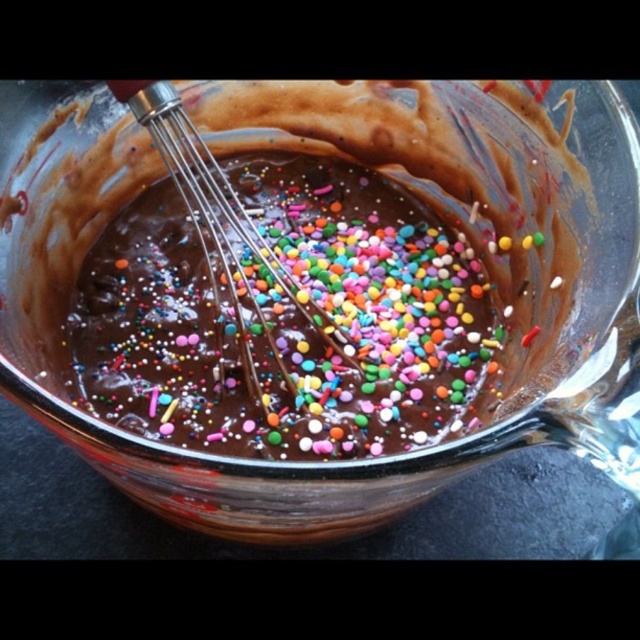
Is transparent glass bowl at center shorter than chocolatesmoothbowl at center?

No.

Does transparent glass bowl at center appear under chocolatesmoothbowl at center?

No.

Identify the location of transparent glass bowl at center. The image size is (640, 640). (324, 157).

Does point (355, 241) come behind point (211, 282)?

Yes, it is behind point (211, 282).

Which is above, chocolatesmoothbowl at center or metallic whisk at center?

metallic whisk at center is above.

Who is more distant from viewer, (260, 452) or (154, 138)?

The point (154, 138) is more distant.

The image size is (640, 640). I want to click on chocolatesmoothbowl at center, so click(289, 320).

Is transparent glass bowl at center taller than metallic whisk at center?

Result: Yes, transparent glass bowl at center is taller than metallic whisk at center.

Which is in front, point (83, 152) or point (177, 106)?

Point (177, 106) is more forward.

This screenshot has height=640, width=640. In order to click on transparent glass bowl at center in this screenshot , I will do `click(324, 157)`.